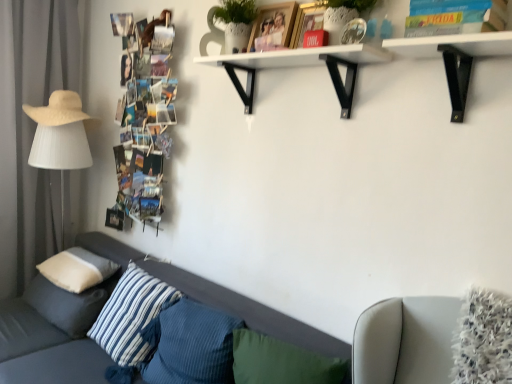
Question: Does white matte shelf at upper center have a lesser height compared to white soft cushion at lower left, the 1th pillow viewed from the left?

Choices:
 (A) no
 (B) yes

Answer: (A)

Question: Considering the relative sizes of white matte shelf at upper center and white soft cushion at lower left, the 1th pillow viewed from the left, in the image provided, is white matte shelf at upper center thinner than white soft cushion at lower left, the 1th pillow viewed from the left,?

Choices:
 (A) no
 (B) yes

Answer: (B)

Question: Is white soft cushion at lower left, which is the 4th pillow in right-to-left order, a part of white matte shelf at upper center?

Choices:
 (A) no
 (B) yes

Answer: (A)

Question: Does white matte shelf at upper center appear on the right side of white soft cushion at lower left, the 1th pillow viewed from the left?

Choices:
 (A) yes
 (B) no

Answer: (A)

Question: Is white matte shelf at upper center turned away from white soft cushion at lower left, the 1th pillow viewed from the left?

Choices:
 (A) yes
 (B) no

Answer: (B)

Question: From a real-world perspective, is white matte shelf at upper center positioned under white soft cushion at lower left, the 1th pillow viewed from the left, based on gravity?

Choices:
 (A) yes
 (B) no

Answer: (B)

Question: Is gray fabric curtain at left oriented towards printed paper collage at left, which is counted as the 2th book, starting from the right?

Choices:
 (A) no
 (B) yes

Answer: (B)

Question: From the image's perspective, is gray fabric curtain at left located beneath printed paper collage at left, placed as the 2th book when sorted from front to back?

Choices:
 (A) no
 (B) yes

Answer: (B)

Question: Is gray fabric curtain at left outside printed paper collage at left, which is counted as the 2th book, starting from the right?

Choices:
 (A) yes
 (B) no

Answer: (A)

Question: Does gray fabric curtain at left have a lesser width compared to printed paper collage at left, which is the 1th book in back-to-front order?

Choices:
 (A) yes
 (B) no

Answer: (B)

Question: Does gray fabric curtain at left appear on the left side of printed paper collage at left, placed as the 2th book when sorted from front to back?

Choices:
 (A) no
 (B) yes

Answer: (B)

Question: From the image's perspective, is gray fabric curtain at left on top of printed paper collage at left, placed as the 2th book when sorted from front to back?

Choices:
 (A) yes
 (B) no

Answer: (B)

Question: Does white matte table lamp at left have a smaller size compared to white matte shelf at upper center?

Choices:
 (A) no
 (B) yes

Answer: (A)